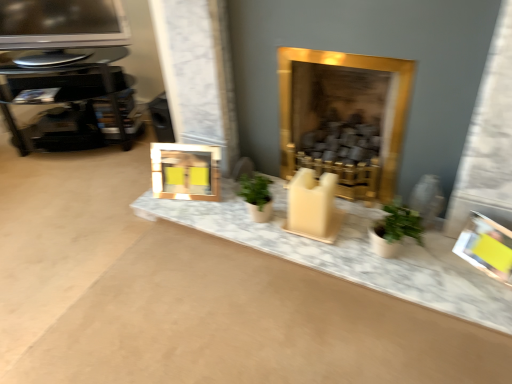
This screenshot has height=384, width=512. Identify the location of vacant area situated to the left side of yellow paper picture frame at right, the second picture frame when ordered from back to front. (444, 269).